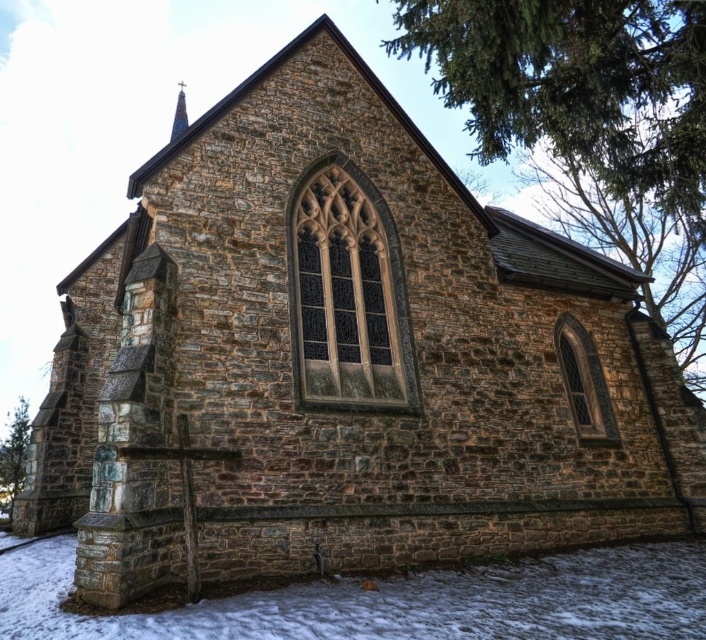
Question: Observing the image, what is the correct spatial positioning of green leafy tree at upper right in reference to green leafy tree at lower left?

Choices:
 (A) below
 (B) above

Answer: (B)

Question: Is green leafy tree at upper right positioned in front of white powdery snow at lower center?

Choices:
 (A) no
 (B) yes

Answer: (A)

Question: Estimate the real-world distances between objects in this image. Which object is farther from the green leafy tree at lower left?

Choices:
 (A) white powdery snow at lower center
 (B) green leafy tree at upper right

Answer: (B)

Question: Which object appears closest to the camera in this image?

Choices:
 (A) green leafy tree at upper right
 (B) green leafy tree at lower left
 (C) white powdery snow at lower center

Answer: (C)

Question: Which object appears closest to the camera in this image?

Choices:
 (A) green leafy tree at lower left
 (B) green leafy tree at upper right
 (C) white powdery snow at lower center

Answer: (C)

Question: Where is green leafy tree at upper right located in relation to green leafy tree at lower left in the image?

Choices:
 (A) left
 (B) right

Answer: (B)